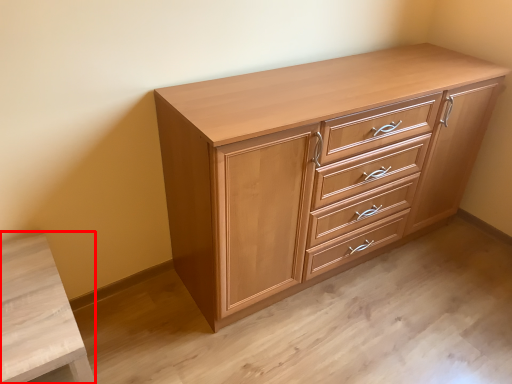
Question: In this image, where is vanity (annotated by the red box) located relative to chest of drawers?

Choices:
 (A) right
 (B) left

Answer: (B)